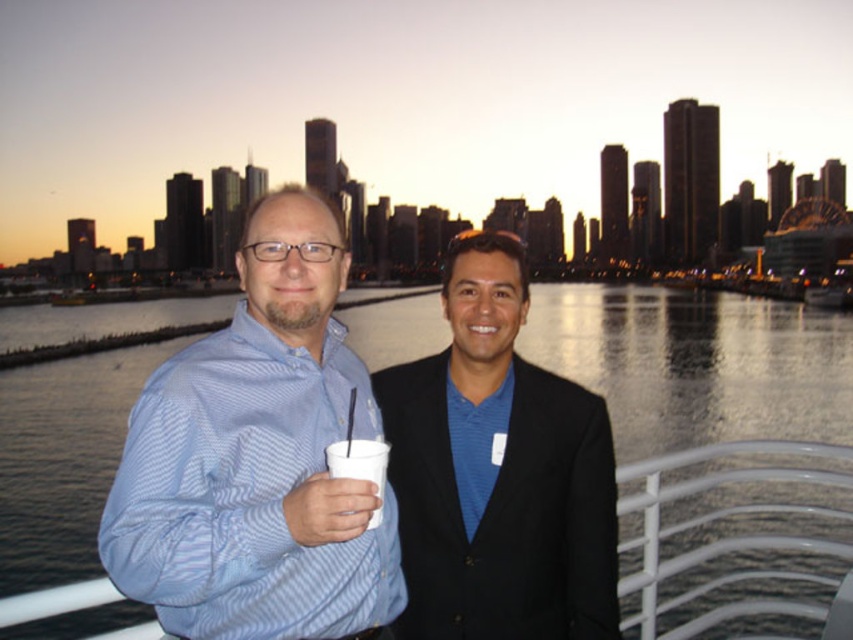
Question: Is blue striped shirt at center bigger than clear water at center?

Choices:
 (A) no
 (B) yes

Answer: (A)

Question: Is blue striped shirt at center closer to camera compared to blue smooth shirt at center?

Choices:
 (A) yes
 (B) no

Answer: (A)

Question: Which point is closer to the camera?

Choices:
 (A) blue smooth shirt at center
 (B) clear water at center
 (C) white paper cup at center

Answer: (B)

Question: Does clear water at center have a greater width compared to blue smooth shirt at center?

Choices:
 (A) no
 (B) yes

Answer: (B)

Question: Estimate the real-world distances between objects in this image. Which object is farther from the blue striped shirt at center?

Choices:
 (A) clear water at center
 (B) white paper cup at center
 (C) blue smooth shirt at center

Answer: (A)

Question: Which point appears farthest from the camera in this image?

Choices:
 (A) (196, 614)
 (B) (804, 333)
 (C) (482, 513)

Answer: (B)